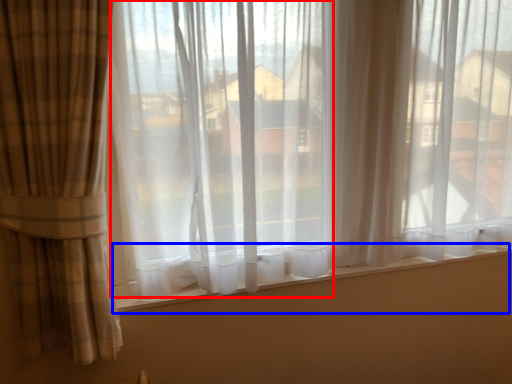
Question: Which object appears farthest to the camera in this image, window screen (highlighted by a red box) or window sill (highlighted by a blue box)?

Choices:
 (A) window screen
 (B) window sill

Answer: (B)